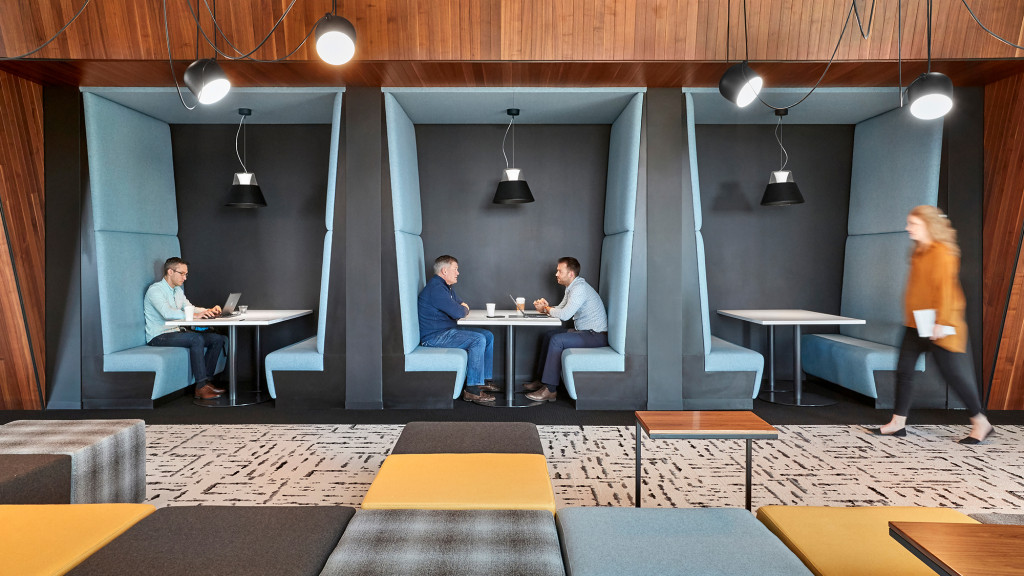
Locate an element on the screen. This screenshot has height=576, width=1024. stand is located at coordinates (724, 427).